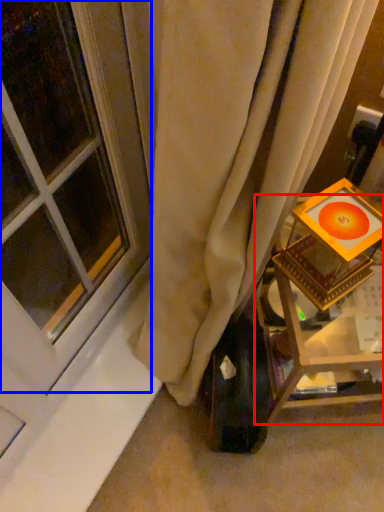
Question: Which point is further to the camera, furniture (highlighted by a red box) or window (highlighted by a blue box)?

Choices:
 (A) furniture
 (B) window

Answer: (A)